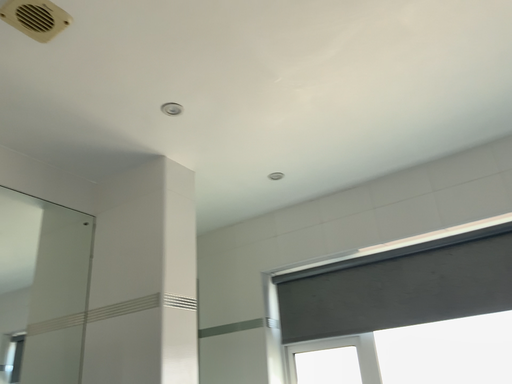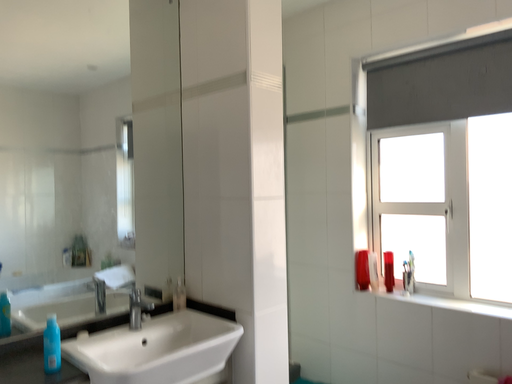
Question: How did the camera likely rotate when shooting the video?

Choices:
 (A) rotated upward
 (B) rotated downward

Answer: (B)